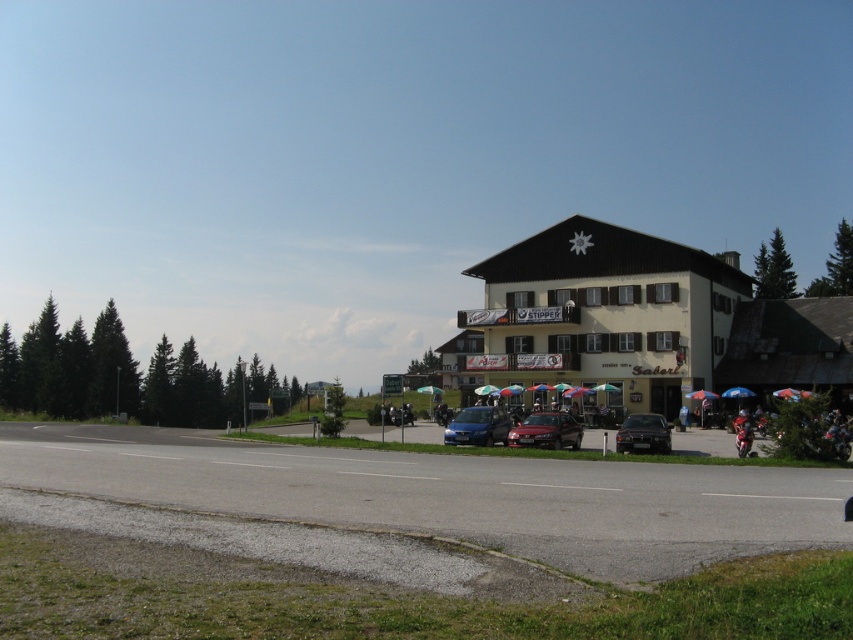
You are a pedestrian standing in the parking lot and want to park your bicycle under an umbrella to stay dry. The wooden umbrella at center and the matte blue car at center are both in your path. Which object should you move to access the other?

The wooden umbrella at center is above the matte blue car at center, so you need to move the wooden umbrella at center to access the matte blue car at center.